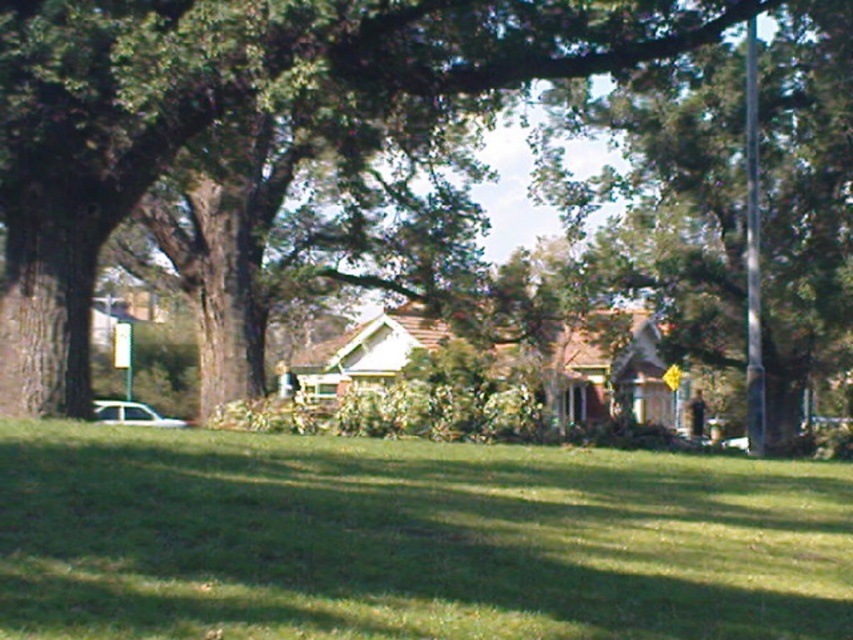
Does green grass at lower center come in front of green leafy tree at center?

Yes, it is in front of green leafy tree at center.

Can you confirm if green grass at lower center is taller than green leafy tree at center?

No.

Locate an element on the screen. This screenshot has height=640, width=853. green grass at lower center is located at coordinates (410, 540).

The image size is (853, 640). I want to click on green grass at lower center, so click(x=410, y=540).